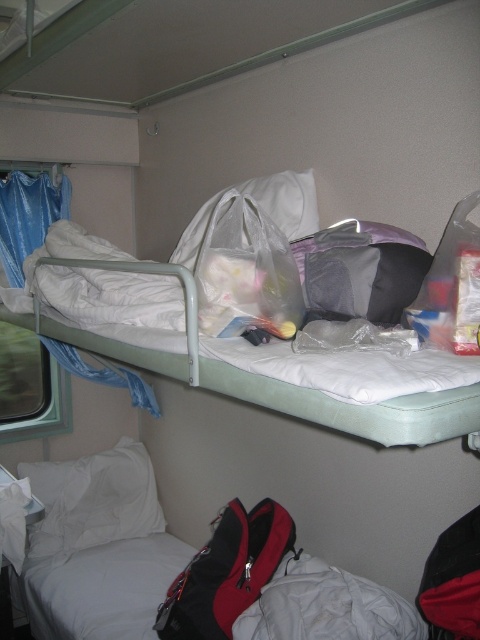
Question: Which of these objects is positioned farthest from the white fabric bunk bed at upper center?

Choices:
 (A) white soft pillow at lower left
 (B) white fabric mattress at lower left
 (C) red fabric backpack at lower center

Answer: (B)

Question: From the image, what is the correct spatial relationship of white fabric bunk bed at upper center in relation to translucent plastic bag at upper right?

Choices:
 (A) below
 (B) above

Answer: (A)

Question: Among these points, which one is farthest from the camera?

Choices:
 (A) (162, 273)
 (B) (310, 188)
 (C) (472, 225)

Answer: (B)

Question: Which object is closer to the camera taking this photo?

Choices:
 (A) white fabric pillow at upper center
 (B) translucent plastic bag at upper right
 (C) white fabric mattress at lower left
 (D) white soft pillow at lower left

Answer: (B)

Question: Is white soft pillow at lower left below white fabric pillow at upper center?

Choices:
 (A) no
 (B) yes

Answer: (B)

Question: Considering the relative positions of red fabric backpack at lower center and translucent plastic bag at upper right in the image provided, where is red fabric backpack at lower center located with respect to translucent plastic bag at upper right?

Choices:
 (A) below
 (B) above

Answer: (A)